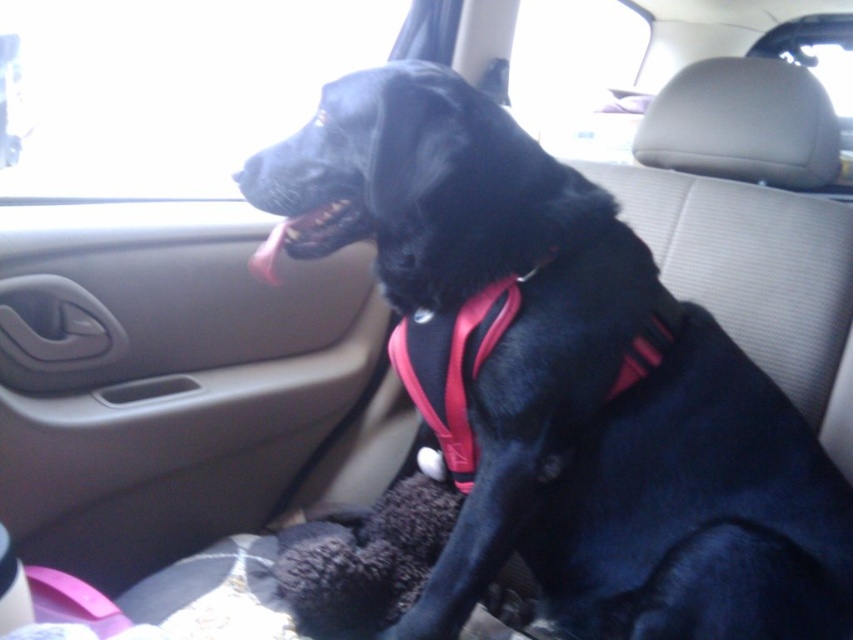
Question: Does black matte dog at center have a greater width compared to black matte teeth at center?

Choices:
 (A) yes
 (B) no

Answer: (A)

Question: Which point is closer to the camera?

Choices:
 (A) black matte dog at center
 (B) black matte teeth at center

Answer: (A)

Question: Is black matte dog at center above black matte teeth at center?

Choices:
 (A) no
 (B) yes

Answer: (A)

Question: Can you confirm if black matte dog at center is positioned below black matte teeth at center?

Choices:
 (A) yes
 (B) no

Answer: (A)

Question: Among these points, which one is farthest from the camera?

Choices:
 (A) (567, 433)
 (B) (302, 234)

Answer: (B)